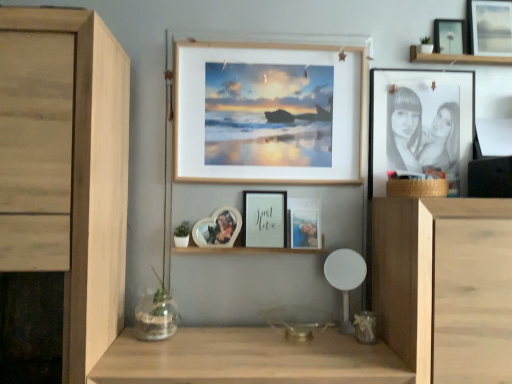
Question: Is white matte chair at center to the left or to the right of metallic silver photo frame at center, the 4th picture frame positioned from the left, in the image?

Choices:
 (A) right
 (B) left

Answer: (A)

Question: From the image's perspective, is white matte chair at center positioned above or below metallic silver photo frame at center, which is the third picture frame from right to left?

Choices:
 (A) below
 (B) above

Answer: (A)

Question: Estimate the real-world distances between objects in this image. Which object is closer to the metallic silver photo frame at center, which is the third picture frame from right to left?

Choices:
 (A) white matte chair at center
 (B) matte black picture frame at upper right, which is counted as the second picture frame, starting from the right
 (C) heart-shaped photo frame at center, positioned as the 1th picture frame in left-to-right order
 (D) light brown wood cabinet at lower right, the second cabinetry in the left-to-right sequence
 (E) wooden frame at upper center, the fourth picture frame when ordered from right to left

Answer: (A)

Question: Estimate the real-world distances between objects in this image. Which object is farther from the matte black picture frame at upper right, which is counted as the second picture frame, starting from the right?

Choices:
 (A) heart-shaped photo frame at center, the 6th picture frame positioned from the right
 (B) white glossy photo frame at center
 (C) metallic silver photo frame at center, the 4th picture frame positioned from the left
 (D) white matte picture frame at center, positioned as the 2th picture frame in left-to-right order
 (E) light brown wood cabinet at lower right, acting as the first cabinetry starting from the right

Answer: (A)